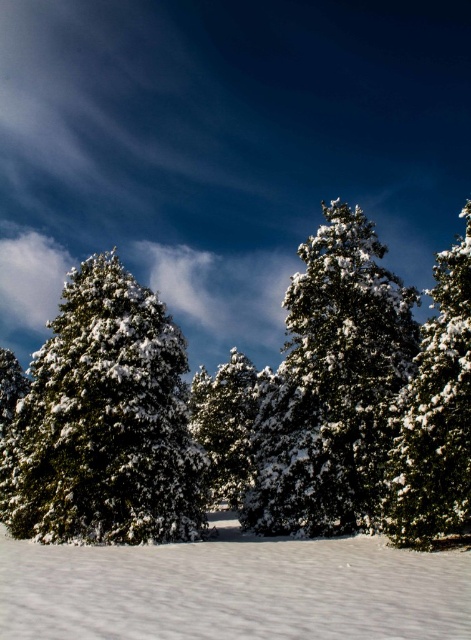
Who is positioned more to the right, green matte tree at center or green matte tree at right?

green matte tree at right is more to the right.

You are a GUI agent. You are given a task and a screenshot of the screen. Output one action in this format:
    pyautogui.click(x=<x>, y=<y>)
    Task: Click on the green matte tree at center
    
    Given the screenshot: What is the action you would take?
    pyautogui.click(x=332, y=385)

At what (x,y) coordinates should I click in order to perform the action: click on green matte tree at center. Please return your answer as a coordinate pair (x, y). The height and width of the screenshot is (640, 471). Looking at the image, I should click on (332, 385).

Is white snow at lower center thinner than green textured pine tree at center?

In fact, white snow at lower center might be wider than green textured pine tree at center.

Which is behind, point (102, 580) or point (191, 392)?

Positioned behind is point (191, 392).

The height and width of the screenshot is (640, 471). I want to click on white snow at lower center, so pyautogui.click(x=233, y=589).

How much distance is there between green matte tree at left and green textured pine tree at center?

green matte tree at left and green textured pine tree at center are 14.68 meters apart.

Does point (42, 371) come in front of point (250, 435)?

Yes, point (42, 371) is in front of point (250, 435).

Find the location of `green matte tree at left`. green matte tree at left is located at coordinates (105, 420).